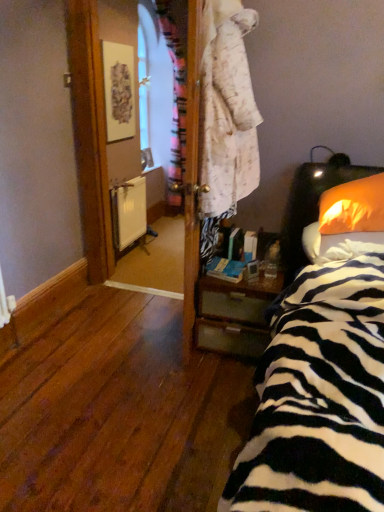
Question: Would you say white matte radiator at center is inside or outside orange fabric pillow at right, the 1th pillow in the top-to-bottom sequence?

Choices:
 (A) outside
 (B) inside

Answer: (A)

Question: In the image, is white matte radiator at center positioned in front of or behind orange fabric pillow at right, the 1th pillow in the top-to-bottom sequence?

Choices:
 (A) front
 (B) behind

Answer: (B)

Question: Estimate the real-world distances between objects in this image. Which object is farther from the orange fabric pillow at right, placed as the first pillow when sorted from bottom to top?

Choices:
 (A) white matte radiator at center
 (B) zebra-patterned fabric at right
 (C) orange fabric pillow at right, the 1th pillow in the top-to-bottom sequence
 (D) wooden nightstand at lower right

Answer: (A)

Question: Which object is the closest to the orange fabric pillow at right, the 1th pillow in the top-to-bottom sequence?

Choices:
 (A) orange fabric pillow at right, which is the second pillow in top-to-bottom order
 (B) white matte radiator at center
 (C) wooden nightstand at lower right
 (D) zebra-patterned fabric at right

Answer: (A)